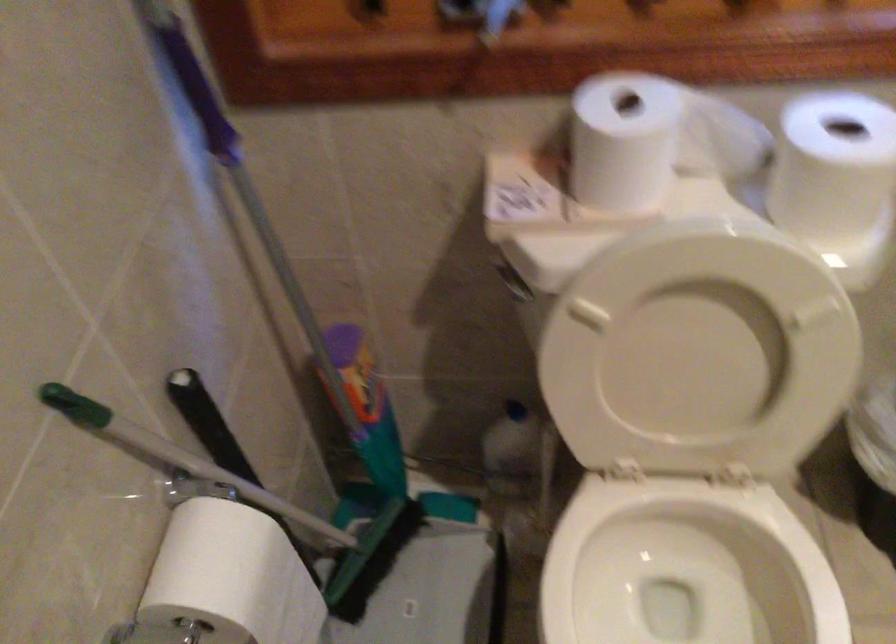
This screenshot has height=644, width=896. Identify the location of black tool handle. (194, 402).